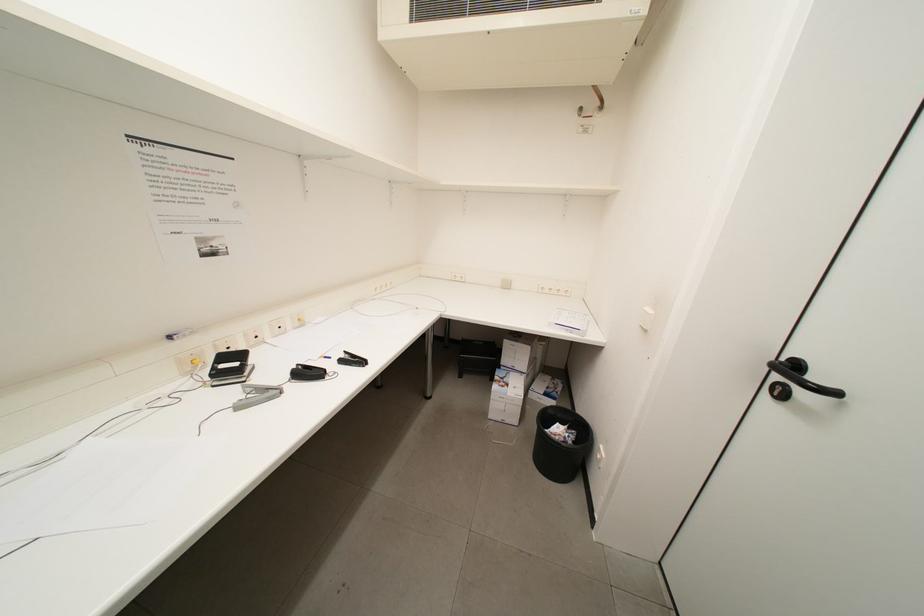
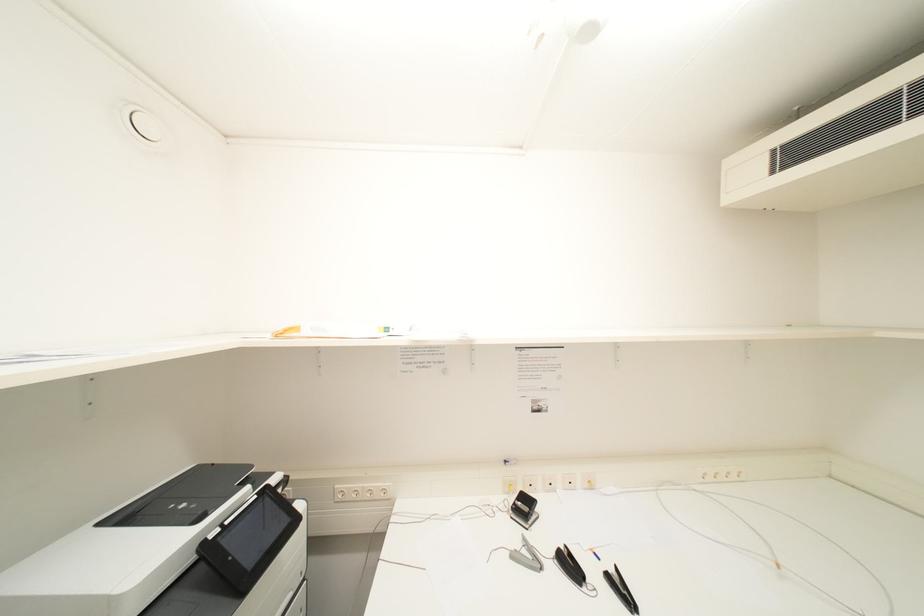
Question: The camera is either moving clockwise (left) or counter-clockwise (right) around the object. The first image is from the beginning of the video and the second image is from the end. Is the camera moving left or right when shooting the video?

Choices:
 (A) Left
 (B) Right

Answer: (B)